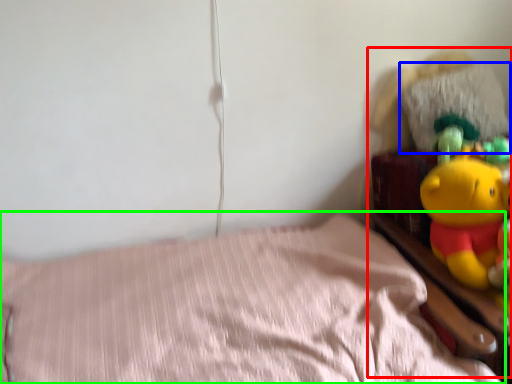
Question: Which is farther away from toy (highlighted by a red box)? pillow (highlighted by a blue box) or bed (highlighted by a green box)?

Choices:
 (A) pillow
 (B) bed

Answer: (B)